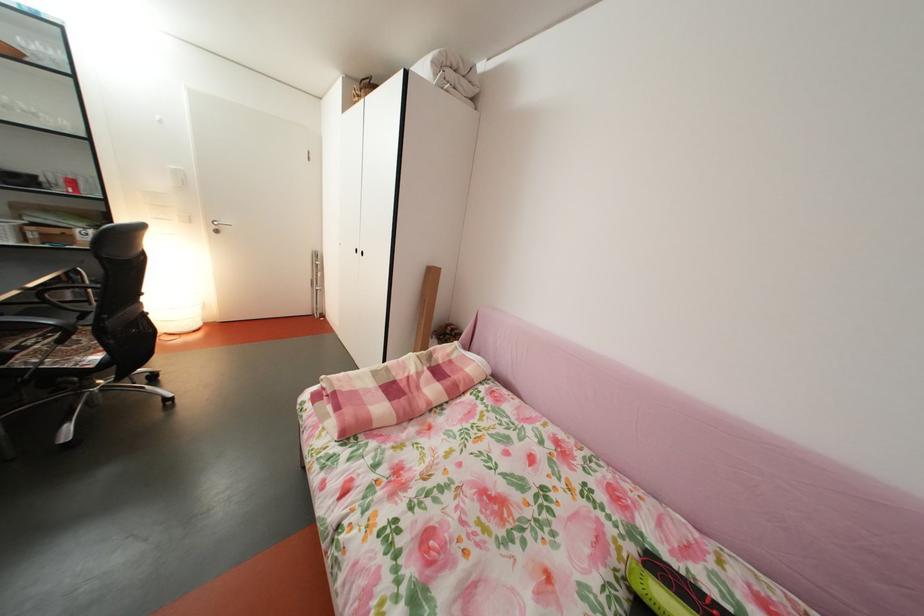
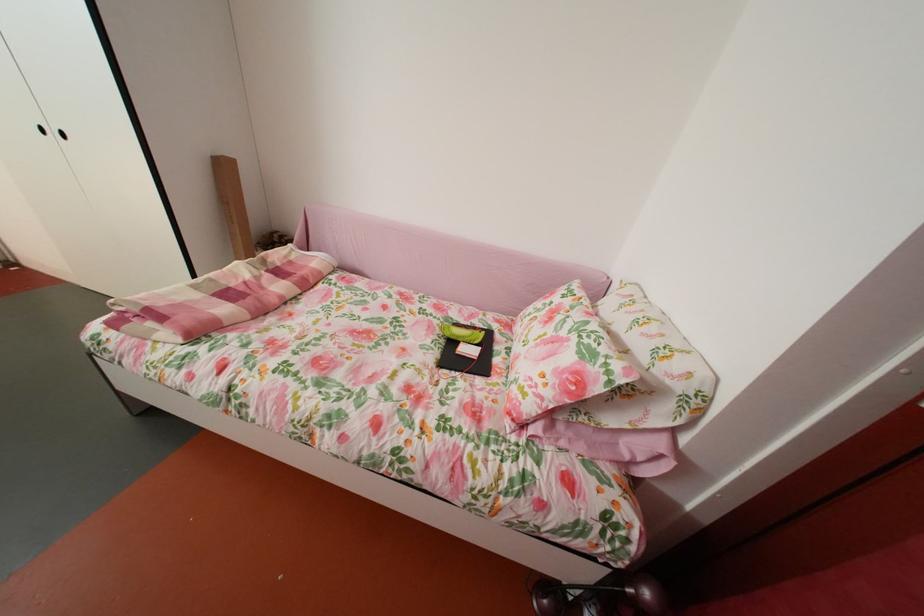
Locate, in the second image, the point that corresponds to (676,562) in the first image.

(473, 328)